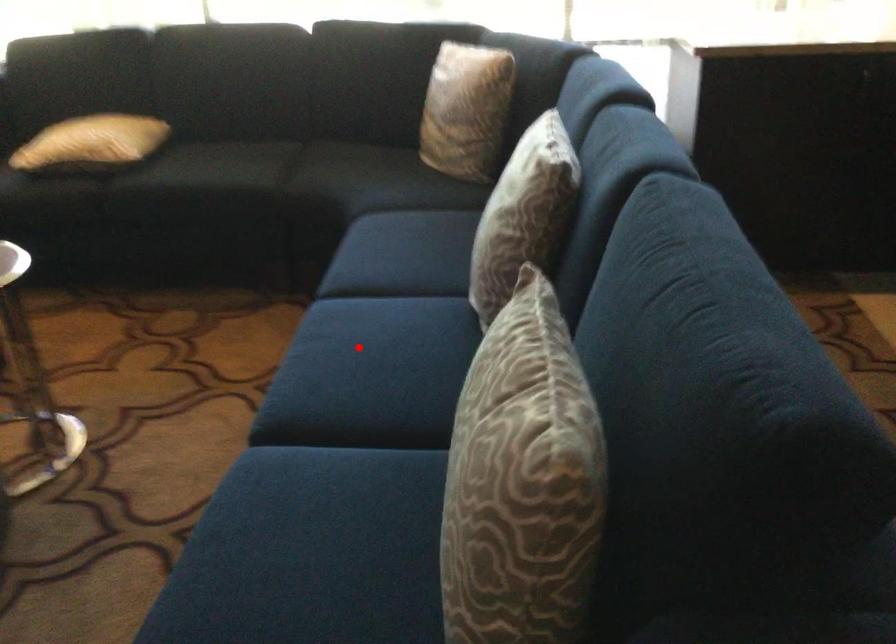
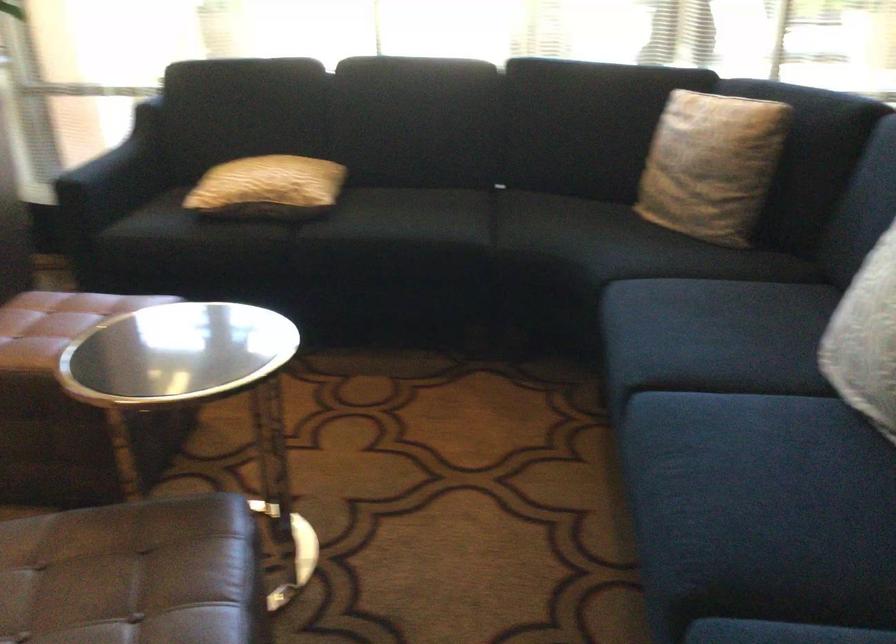
Where in the second image is the point corresponding to the highlighted location from the first image?

(745, 459)